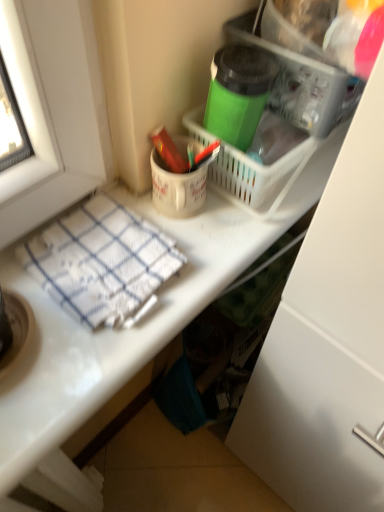
Question: Considering the relative sizes of white woven towel at lower left and matte red crayon at upper center in the image provided, is white woven towel at lower left bigger than matte red crayon at upper center?

Choices:
 (A) no
 (B) yes

Answer: (B)

Question: Considering the relative positions of white woven towel at lower left and matte red crayon at upper center in the image provided, is white woven towel at lower left behind matte red crayon at upper center?

Choices:
 (A) no
 (B) yes

Answer: (A)

Question: From the image's perspective, is white woven towel at lower left on top of matte red crayon at upper center?

Choices:
 (A) yes
 (B) no

Answer: (B)

Question: Is the position of white woven towel at lower left less distant than that of matte red crayon at upper center?

Choices:
 (A) no
 (B) yes

Answer: (B)

Question: Could you tell me if white woven towel at lower left is turned towards matte red crayon at upper center?

Choices:
 (A) yes
 (B) no

Answer: (B)

Question: Considering the relative sizes of white woven towel at lower left and matte red crayon at upper center in the image provided, is white woven towel at lower left wider than matte red crayon at upper center?

Choices:
 (A) no
 (B) yes

Answer: (B)

Question: Is green matte thermos at upper center placed right next to white woven towel at lower left?

Choices:
 (A) no
 (B) yes

Answer: (A)

Question: Is green matte thermos at upper center positioned far away from white woven towel at lower left?

Choices:
 (A) yes
 (B) no

Answer: (B)

Question: Can you confirm if green matte thermos at upper center is shorter than white woven towel at lower left?

Choices:
 (A) no
 (B) yes

Answer: (A)

Question: From the image's perspective, is green matte thermos at upper center located beneath white woven towel at lower left?

Choices:
 (A) yes
 (B) no

Answer: (B)

Question: Is green matte thermos at upper center outside of white woven towel at lower left?

Choices:
 (A) yes
 (B) no

Answer: (A)

Question: Considering the relative sizes of green matte thermos at upper center and white woven towel at lower left in the image provided, is green matte thermos at upper center wider than white woven towel at lower left?

Choices:
 (A) yes
 (B) no

Answer: (B)

Question: Does matte red crayon at upper center come behind white woven towel at lower left?

Choices:
 (A) no
 (B) yes

Answer: (B)